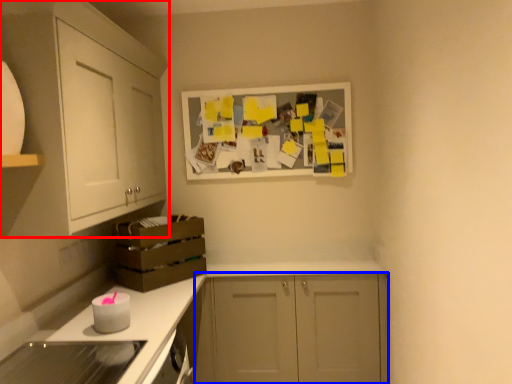
Question: Which of the following is the closest to the observer, cabinetry (highlighted by a red box) or cabinetry (highlighted by a blue box)?

Choices:
 (A) cabinetry
 (B) cabinetry

Answer: (A)